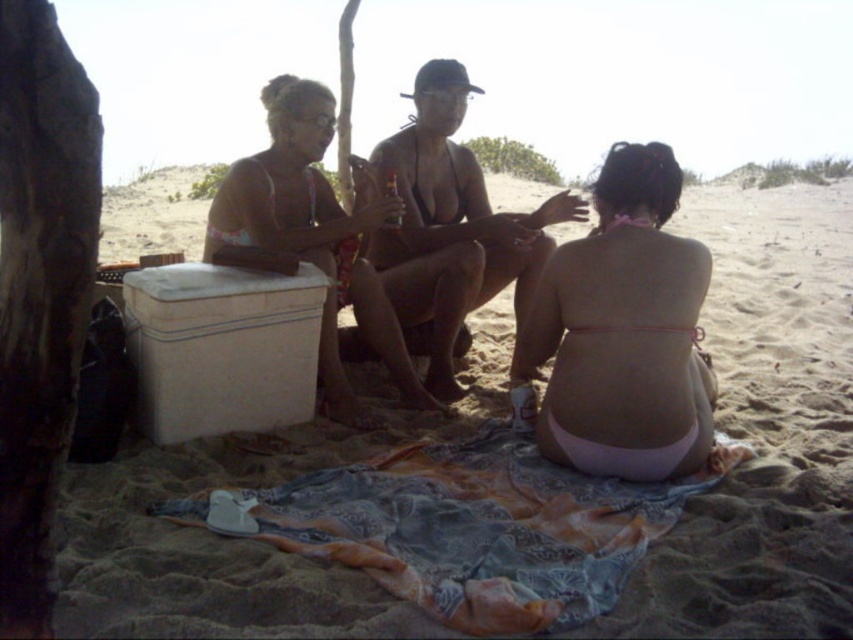
You are a photographer trying to capture a candid shot of the matte black bikini at center without the printed cotton blanket at lower center appearing in the background. Based on their distance, can you position yourself in a way to achieve this?

The printed cotton blanket at lower center and matte black bikini at center are 38.45 inches apart. Since the distance between them is significant, you can position yourself at an angle where the blanket is out of the frame while still capturing the bikini.

You are standing on the beach and want to place a 1.5 meter long beach umbrella between you and the beige sand at center. Will the umbrella fit entirely within that space?

The distance between you and the beige sand at center is 1.86 meters, which is greater than the 1.5 meter length of the umbrella. Therefore, the umbrella will fit entirely within that space.